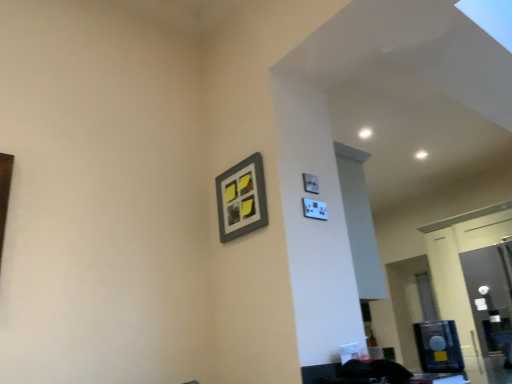
Question: Is transparent glass door at right not close to matte gray picture frame at upper right?

Choices:
 (A) no
 (B) yes

Answer: (B)

Question: Is transparent glass door at right turned away from matte gray picture frame at upper right?

Choices:
 (A) no
 (B) yes

Answer: (A)

Question: Considering the relative sizes of transparent glass door at right and matte gray picture frame at upper right in the image provided, is transparent glass door at right taller than matte gray picture frame at upper right?

Choices:
 (A) yes
 (B) no

Answer: (A)

Question: Does transparent glass door at right turn towards matte gray picture frame at upper right?

Choices:
 (A) yes
 (B) no

Answer: (A)

Question: Could matte gray picture frame at upper right be considered to be inside transparent glass door at right?

Choices:
 (A) no
 (B) yes

Answer: (A)

Question: Is transparent glass door at right at the left side of matte gray picture frame at upper right?

Choices:
 (A) no
 (B) yes

Answer: (A)

Question: Does matte gray picture frame at upper right have a smaller size compared to transparent glass door at right?

Choices:
 (A) no
 (B) yes

Answer: (B)

Question: Does matte gray picture frame at upper right appear on the right side of transparent glass door at right?

Choices:
 (A) no
 (B) yes

Answer: (A)

Question: Considering the relative sizes of matte gray picture frame at upper right and transparent glass door at right in the image provided, is matte gray picture frame at upper right bigger than transparent glass door at right?

Choices:
 (A) yes
 (B) no

Answer: (B)

Question: Is matte gray picture frame at upper right thinner than transparent glass door at right?

Choices:
 (A) yes
 (B) no

Answer: (A)

Question: From a real-world perspective, is matte gray picture frame at upper right on top of transparent glass door at right?

Choices:
 (A) yes
 (B) no

Answer: (A)

Question: Is matte gray picture frame at upper right oriented away from transparent glass door at right?

Choices:
 (A) no
 (B) yes

Answer: (B)

Question: Looking at their shapes, would you say matte gray picture frame at upper right is wider or thinner than transparent glass door at right?

Choices:
 (A) thin
 (B) wide

Answer: (A)